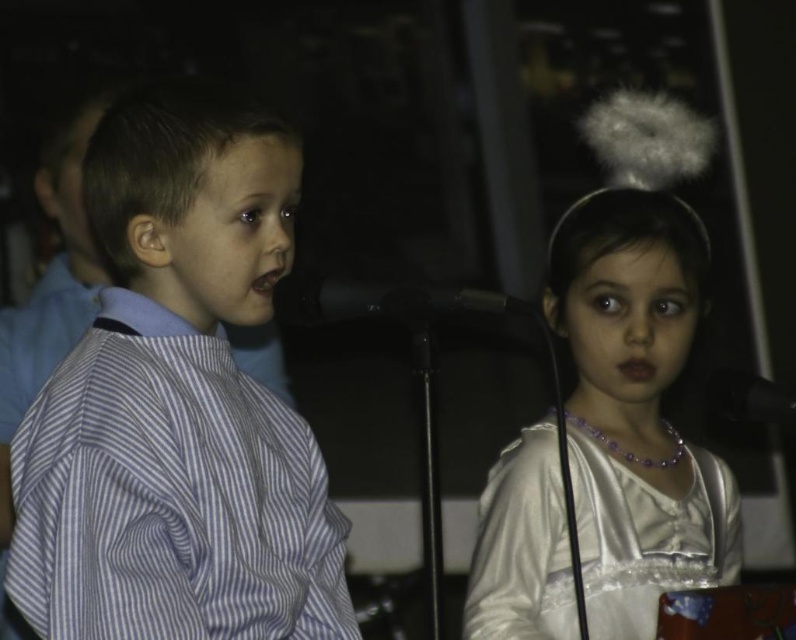
Question: Which point appears closest to the camera in this image?

Choices:
 (A) (154, 316)
 (B) (529, 301)

Answer: (A)

Question: Is silvery satin dress at center to the right of black matte microphone at center from the viewer's perspective?

Choices:
 (A) no
 (B) yes

Answer: (A)

Question: Is the position of blue striped shirt at left less distant than that of white satin dress at lower right?

Choices:
 (A) yes
 (B) no

Answer: (A)

Question: Is blue striped shirt at left closer to camera compared to black plastic microphone at center?

Choices:
 (A) no
 (B) yes

Answer: (B)

Question: Among these objects, which one is farthest from the camera?

Choices:
 (A) black plastic microphone at center
 (B) silvery satin dress at center

Answer: (B)

Question: Considering the real-world distances, which object is closest to the black matte microphone at center?

Choices:
 (A) black plastic microphone at center
 (B) silvery satin dress at center

Answer: (B)